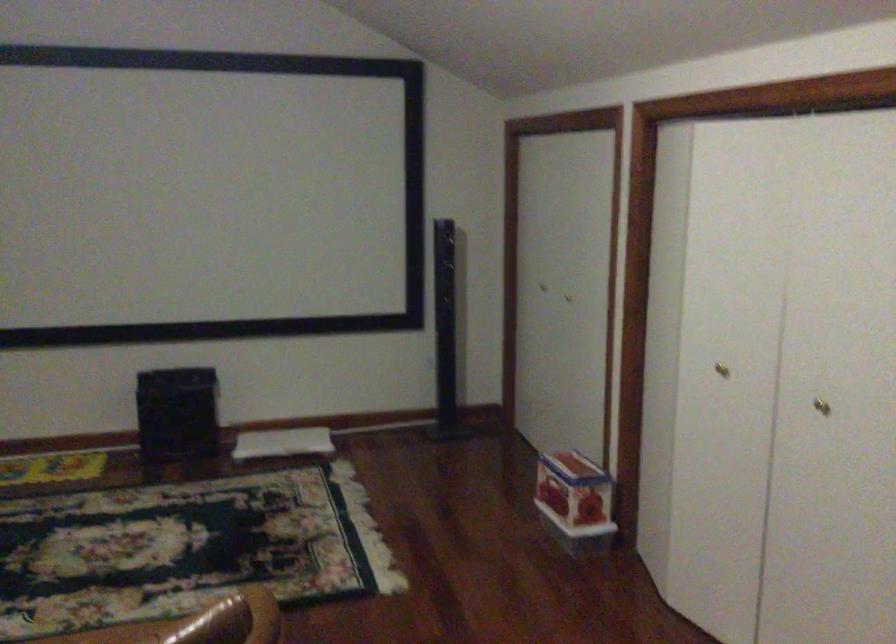
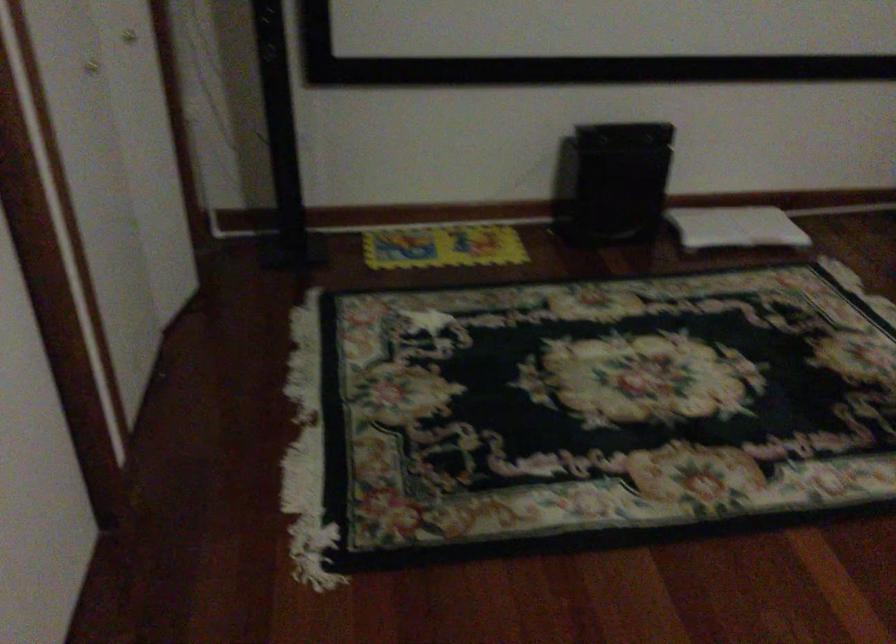
The images are taken continuously from a first-person perspective. In which direction are you moving?

The cameraman walked toward left, forward.